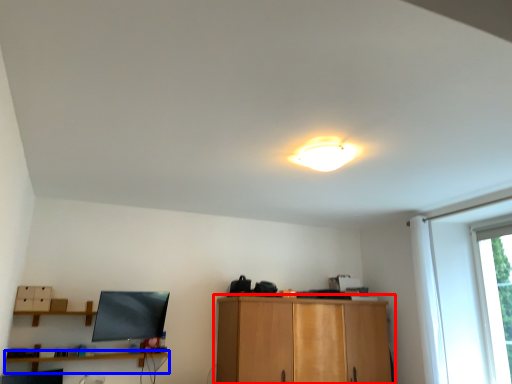
Question: Which object is closer to the camera taking this photo, cabinetry (highlighted by a red box) or shelf (highlighted by a blue box)?

Choices:
 (A) cabinetry
 (B) shelf

Answer: (B)